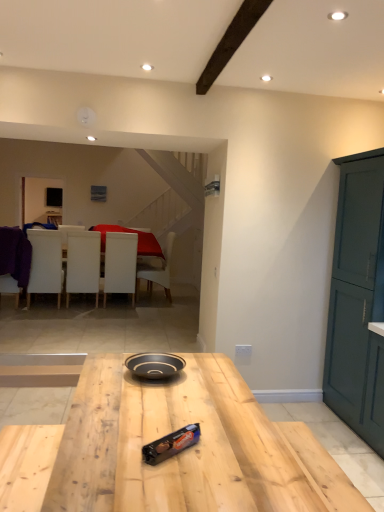
Where is `free space between matte black bowl at center and shiny chocolate bar at center`? Image resolution: width=384 pixels, height=512 pixels. free space between matte black bowl at center and shiny chocolate bar at center is located at coordinates pos(168,414).